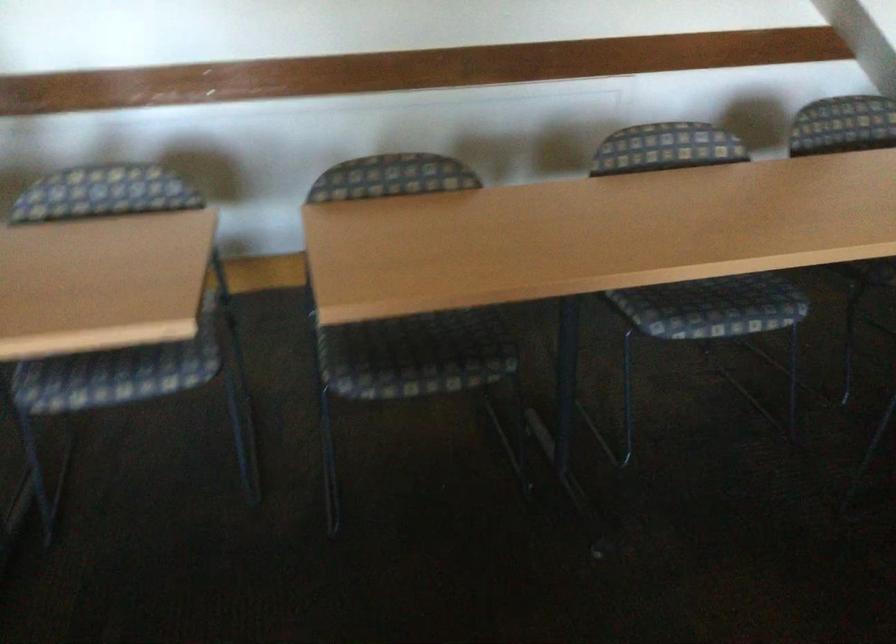
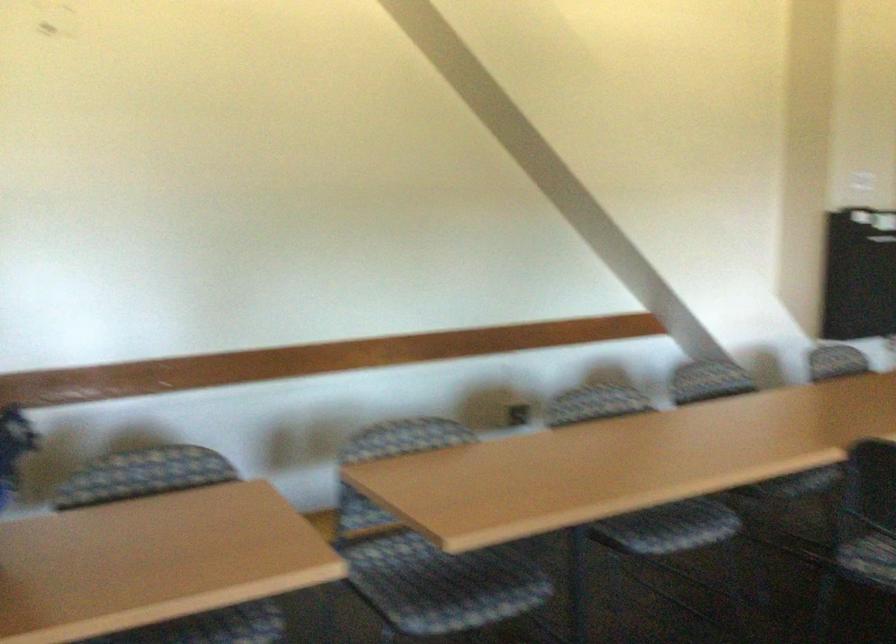
The first image is from the beginning of the video and the second image is from the end. How did the camera likely rotate when shooting the video?

The camera rotated toward right-up.